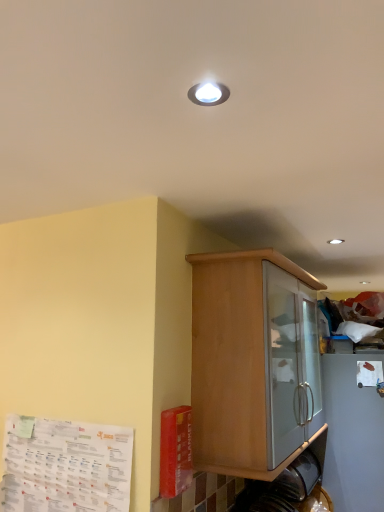
What is the approximate height of wooden cabinet at center?

It is 31.95 inches.

What do you see at coordinates (369, 373) in the screenshot? Image resolution: width=384 pixels, height=512 pixels. I see `white matte paper at upper right, the 1th paper when ordered from back to front` at bounding box center [369, 373].

You are a GUI agent. You are given a task and a screenshot of the screen. Output one action in this format:
    pyautogui.click(x=<x>, y=<y>)
    Task: Click on the wooden cabinet at center
    
    Given the screenshot: What is the action you would take?
    pyautogui.click(x=251, y=360)

Where is `paper on the right of wooden cabinet at center`? The height and width of the screenshot is (512, 384). paper on the right of wooden cabinet at center is located at coordinates (369, 373).

Is point (367, 361) in front of point (286, 421)?

No, (367, 361) is further to viewer.

From a real-world perspective, is white matte paper at upper right, which ranks as the second paper in front-to-back order, positioned above or below wooden cabinet at center?

white matte paper at upper right, which ranks as the second paper in front-to-back order, is below wooden cabinet at center.

What's the angular difference between white matte paper at upper right, the 1th paper when ordered from back to front, and wooden cabinet at center's facing directions?

The facing directions of white matte paper at upper right, the 1th paper when ordered from back to front, and wooden cabinet at center are 177 degrees apart.

Considering the sizes of objects wooden cabinet at center and white matte paper at upper right, the second paper viewed from the left, in the image provided, who is shorter, wooden cabinet at center or white matte paper at upper right, the second paper viewed from the left,?

white matte paper at upper right, the second paper viewed from the left.

Is wooden cabinet at center facing away from white matte paper at upper right, the 1th paper when ordered from back to front?

wooden cabinet at center does not have its back to white matte paper at upper right, the 1th paper when ordered from back to front.

In order to click on cabinetry above the white matte paper at upper right, the second paper viewed from the left (from the image's perspective) in this screenshot , I will do `click(251, 360)`.

Which of these two, wooden cabinet at center or white matte paper at upper right, which ranks as the second paper in front-to-back order, is smaller?

white matte paper at upper right, which ranks as the second paper in front-to-back order, is smaller.

From the image's perspective, which paper is the 2nd one below the wooden cabinet at center? Please provide its 2D coordinates.

[(65, 466)]

Is white paper at lower left, which is the second paper in right-to-left order, turned away from wooden cabinet at center?

Yes, white paper at lower left, which is the second paper in right-to-left order, is facing away from wooden cabinet at center.

Between white paper at lower left, marked as the 1th paper in a front-to-back arrangement, and wooden cabinet at center, which one appears on the right side from the viewer's perspective?

wooden cabinet at center.

From the image's perspective, relative to wooden cabinet at center, is white paper at lower left, which appears as the 2th paper when viewed from the back, above or below?

Based on their image positions, white paper at lower left, which appears as the 2th paper when viewed from the back, is located beneath wooden cabinet at center.

Is point (235, 384) positioned behind point (116, 439)?

Yes, it is.

How many degrees apart are the facing directions of wooden cabinet at center and white paper at lower left, arranged as the 1th paper when viewed from the left?

There is a 90.2-degree angle between the facing directions of wooden cabinet at center and white paper at lower left, arranged as the 1th paper when viewed from the left.

From a real-world perspective, between wooden cabinet at center and white paper at lower left, which is the second paper in right-to-left order, who is vertically higher?

wooden cabinet at center, from a real-world perspective.

Find the location of `paper lying in front of the wooden cabinet at center`. paper lying in front of the wooden cabinet at center is located at coordinates (65, 466).

In terms of width, does white matte paper at upper right, the second paper viewed from the left, look wider or thinner when compared to white paper at lower left, which appears as the 2th paper when viewed from the back?

In the image, white matte paper at upper right, the second paper viewed from the left, appears to be wider than white paper at lower left, which appears as the 2th paper when viewed from the back.

From the image's perspective, is white matte paper at upper right, which ranks as the second paper in front-to-back order, positioned above or below white paper at lower left, which appears as the 2th paper when viewed from the back?

white matte paper at upper right, which ranks as the second paper in front-to-back order, is above white paper at lower left, which appears as the 2th paper when viewed from the back.

Considering the sizes of objects white matte paper at upper right, which ranks as the second paper in front-to-back order, and white paper at lower left, which appears as the 2th paper when viewed from the back, in the image provided, who is bigger, white matte paper at upper right, which ranks as the second paper in front-to-back order, or white paper at lower left, which appears as the 2th paper when viewed from the back,?

white paper at lower left, which appears as the 2th paper when viewed from the back.

Can you confirm if white matte paper at upper right, the 1th paper when ordered from back to front, is positioned to the right of white paper at lower left, which is the second paper in right-to-left order?

Indeed, white matte paper at upper right, the 1th paper when ordered from back to front, is positioned on the right side of white paper at lower left, which is the second paper in right-to-left order.

Is point (124, 453) closer to camera compared to point (377, 371)?

Yes, point (124, 453) is in front of point (377, 371).

How different are the orientations of white paper at lower left, arranged as the 1th paper when viewed from the left, and white matte paper at upper right, arranged as the first paper when viewed from the right, in degrees?

92.7 degrees separate the facing orientations of white paper at lower left, arranged as the 1th paper when viewed from the left, and white matte paper at upper right, arranged as the first paper when viewed from the right.

Is white matte paper at upper right, which ranks as the second paper in front-to-back order, surrounded by white paper at lower left, arranged as the 1th paper when viewed from the left?

Definitely not — white matte paper at upper right, which ranks as the second paper in front-to-back order, is not inside white paper at lower left, arranged as the 1th paper when viewed from the left.

This screenshot has height=512, width=384. In order to click on the 1st paper below when counting from the wooden cabinet at center (from the image's perspective) in this screenshot , I will do point(369,373).

There is a wooden cabinet at center. At what (x,y) coordinates should I click in order to perform the action: click on the 1st paper below it (from a real-world perspective). Please return your answer as a coordinate pair (x, y). This screenshot has width=384, height=512. Looking at the image, I should click on (369, 373).

Looking at the image, which one is located closer to white matte paper at upper right, arranged as the first paper when viewed from the right, white paper at lower left, which is the second paper in right-to-left order, or wooden cabinet at center?

wooden cabinet at center.

Estimate the real-world distances between objects in this image. Which object is further from white paper at lower left, which is the second paper in right-to-left order, white matte paper at upper right, the second paper viewed from the left, or wooden cabinet at center?

white matte paper at upper right, the second paper viewed from the left, is further to white paper at lower left, which is the second paper in right-to-left order.

From the image, which object appears to be farther from white paper at lower left, which is the second paper in right-to-left order, wooden cabinet at center or white matte paper at upper right, arranged as the first paper when viewed from the right?

Based on the image, white matte paper at upper right, arranged as the first paper when viewed from the right, appears to be further to white paper at lower left, which is the second paper in right-to-left order.

Which object lies further to the anchor point wooden cabinet at center, white matte paper at upper right, arranged as the first paper when viewed from the right, or white paper at lower left, which is the second paper in right-to-left order?

Among the two, white matte paper at upper right, arranged as the first paper when viewed from the right, is located further to wooden cabinet at center.

Estimate the real-world distances between objects in this image. Which object is closer to white matte paper at upper right, the 1th paper when ordered from back to front, wooden cabinet at center or white paper at lower left, which is the second paper in right-to-left order?

Based on the image, wooden cabinet at center appears to be nearer to white matte paper at upper right, the 1th paper when ordered from back to front.

Estimate the real-world distances between objects in this image. Which object is closer to wooden cabinet at center, white paper at lower left, arranged as the 1th paper when viewed from the left, or white matte paper at upper right, the second paper viewed from the left?

white paper at lower left, arranged as the 1th paper when viewed from the left, is positioned closer to the anchor wooden cabinet at center.

The width and height of the screenshot is (384, 512). In order to click on cabinetry located between white paper at lower left, which appears as the 2th paper when viewed from the back, and white matte paper at upper right, the 1th paper when ordered from back to front, in the left-right direction in this screenshot , I will do pyautogui.click(x=251, y=360).